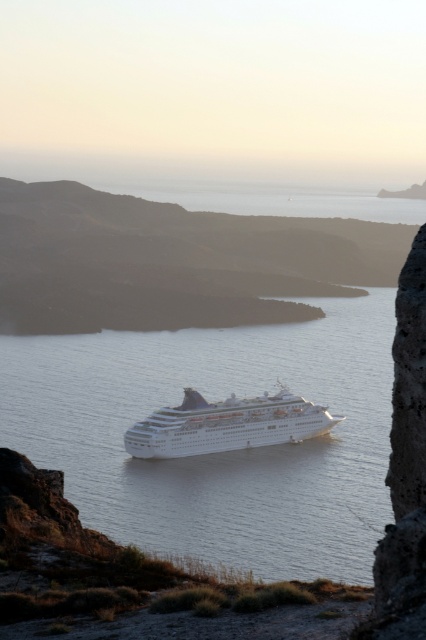
Is white glossy water at center above white glossy cruise ship at center?

Yes, white glossy water at center is above white glossy cruise ship at center.

Based on the photo, between white glossy water at center and white glossy cruise ship at center, which one appears on the right side from the viewer's perspective?

white glossy water at center

The height and width of the screenshot is (640, 426). Identify the location of white glossy water at center. (221, 452).